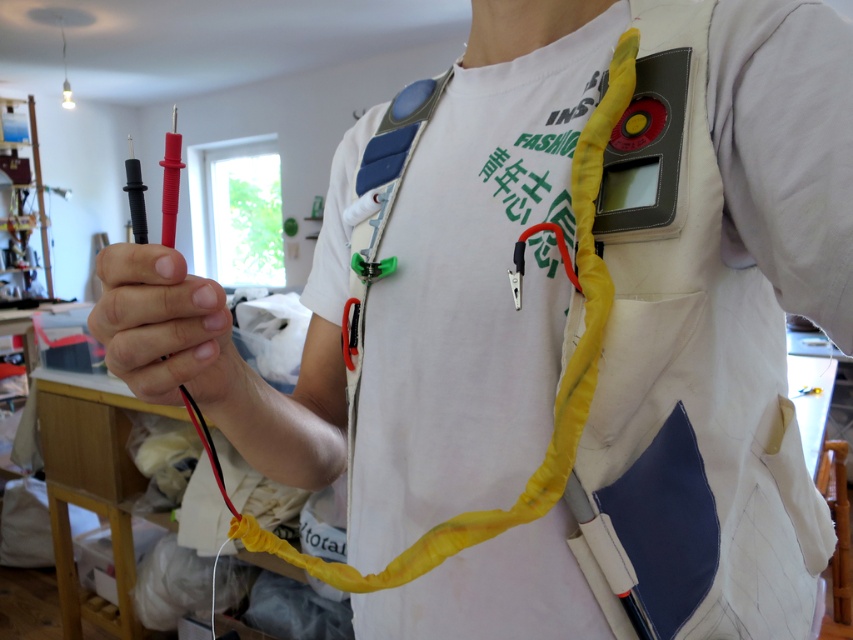
Can you confirm if black rubber gloves at center is wider than red plastic multimeter probes at left?

No.

Who is more forward, (207,298) or (166,161)?

Positioned in front is point (207,298).

Is point (154, 330) farther from viewer compared to point (171, 140)?

No, (154, 330) is in front of (171, 140).

At what (x,y) coordinates should I click in order to perform the action: click on black rubber gloves at center. Please return your answer as a coordinate pair (x, y). The width and height of the screenshot is (853, 640). Looking at the image, I should click on (167, 330).

Who is more forward, (173, 230) or (128, 173)?

Point (173, 230) is more forward.

Does red plastic multimeter probes at left have a greater height compared to black plastic multimeter probe at left?

Yes.

Does point (177, 166) come closer to viewer compared to point (138, 168)?

That is True.

Locate an element on the screen. red plastic multimeter probes at left is located at coordinates (170, 182).

Can you confirm if black rubber gloves at center is positioned below black plastic multimeter probe at left?

Indeed, black rubber gloves at center is positioned under black plastic multimeter probe at left.

Does black rubber gloves at center appear on the left side of black plastic multimeter probe at left?

No, black rubber gloves at center is not to the left of black plastic multimeter probe at left.

Which is in front, point (167, 289) or point (146, 227)?

Point (167, 289) is in front.

Identify the location of black rubber gloves at center. Image resolution: width=853 pixels, height=640 pixels. tap(167, 330).